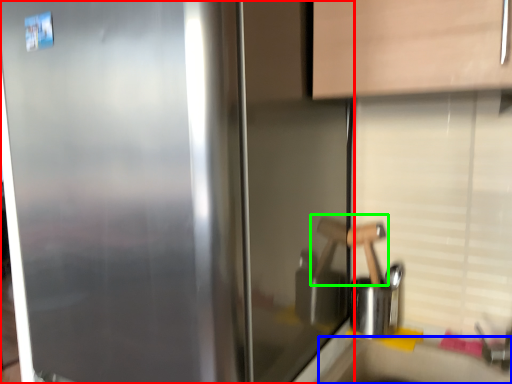
Question: Considering the real-world distances, which object is farthest from refrigerator (highlighted by a red box)? counter top (highlighted by a blue box) or door handle (highlighted by a green box)?

Choices:
 (A) counter top
 (B) door handle

Answer: (A)